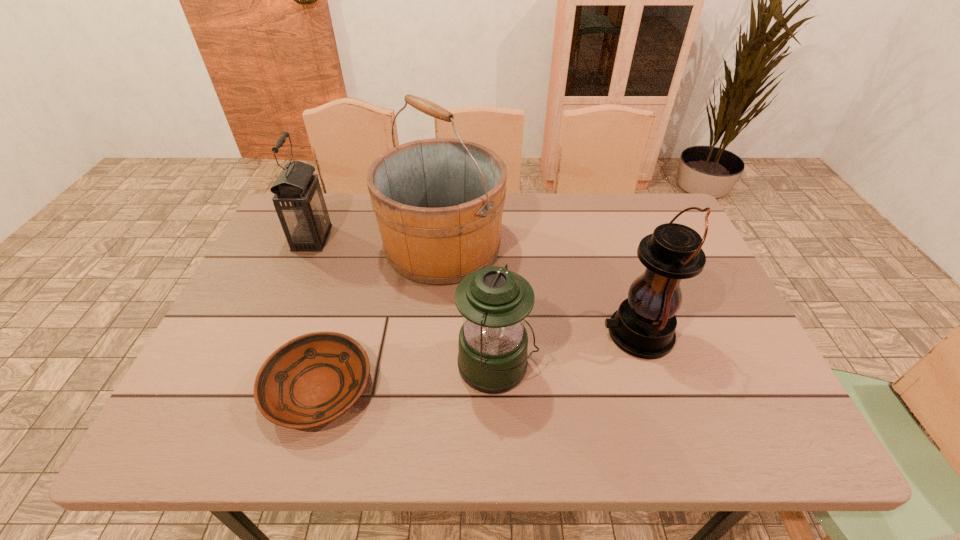
Locate an element on the screen. This screenshot has height=540, width=960. bucket is located at coordinates (438, 202).

Identify the location of the rightmost lantern. This screenshot has width=960, height=540. (644, 325).

This screenshot has height=540, width=960. I want to click on the leftmost lantern, so click(298, 199).

Locate an element on the screen. This screenshot has height=540, width=960. the second shortest object is located at coordinates (492, 348).

Find the location of a particular element. The image size is (960, 540). the second lantern from right to left is located at coordinates (492, 348).

The width and height of the screenshot is (960, 540). I want to click on the shortest object, so click(x=313, y=379).

Locate an element on the screen. The height and width of the screenshot is (540, 960). vacant space situated on the front of the bucket is located at coordinates click(436, 319).

Locate any vacant position located 0.400m above the rightmost lantern, indicating its light source in the image. Please provide its 2D coordinates. Your answer should be formatted as a tuple, i.e. [(x, y)], where the tuple contains the x and y coordinates of a point satisfying the conditions above.

[(430, 334)]

Pinpoint the vacant space located 0.370m above the rightmost lantern, indicating its light source. Please provide its 2D coordinates. Your answer should be formatted as a tuple, i.e. [(x, y)], where the tuple contains the x and y coordinates of a point satisfying the conditions above.

[(443, 334)]

Identify a few spots in the free region located above the rightmost lantern, indicating its light source. Please provide its 2D coordinates. Your answer should be formatted as a tuple, i.e. [(x, y)], where the tuple contains the x and y coordinates of a point satisfying the conditions above.

[(508, 334)]